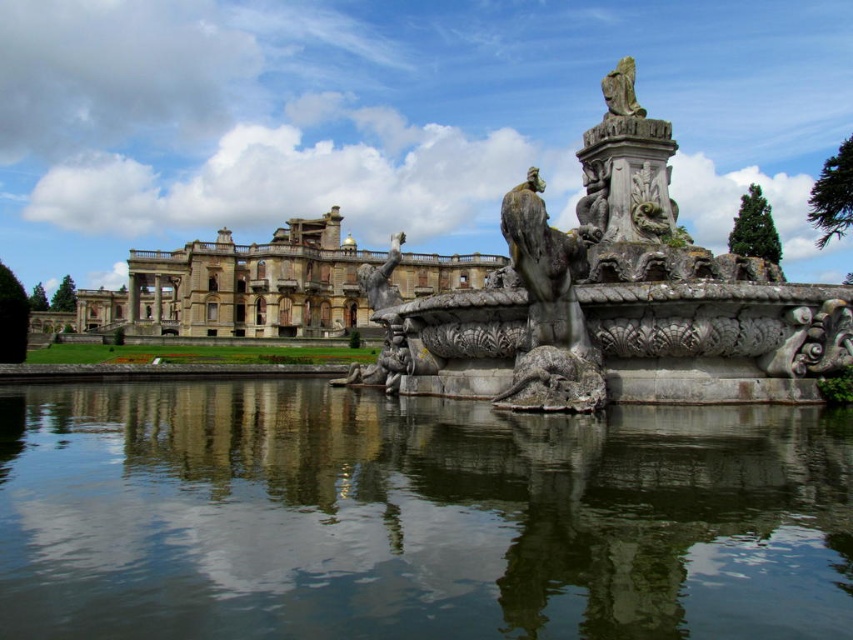
Question: Can you confirm if transparent glass water at center is smaller than gray stone dragon at center?

Choices:
 (A) no
 (B) yes

Answer: (A)

Question: Which point is farther to the camera?

Choices:
 (A) (166, 280)
 (B) (234, 396)

Answer: (A)

Question: Does gray stone fountain at center have a smaller size compared to beige stone palace at center?

Choices:
 (A) yes
 (B) no

Answer: (A)

Question: Which of the following is the farthest from the observer?

Choices:
 (A) gray stone fountain at center
 (B) beige stone palace at center
 (C) transparent glass water at center

Answer: (B)

Question: In this image, where is gray stone fountain at center located relative to gray stone dragon at center?

Choices:
 (A) below
 (B) above

Answer: (B)

Question: Which point is closer to the camera?

Choices:
 (A) click(780, 568)
 (B) click(602, 385)
 (C) click(152, 314)
 (D) click(372, 372)

Answer: (A)